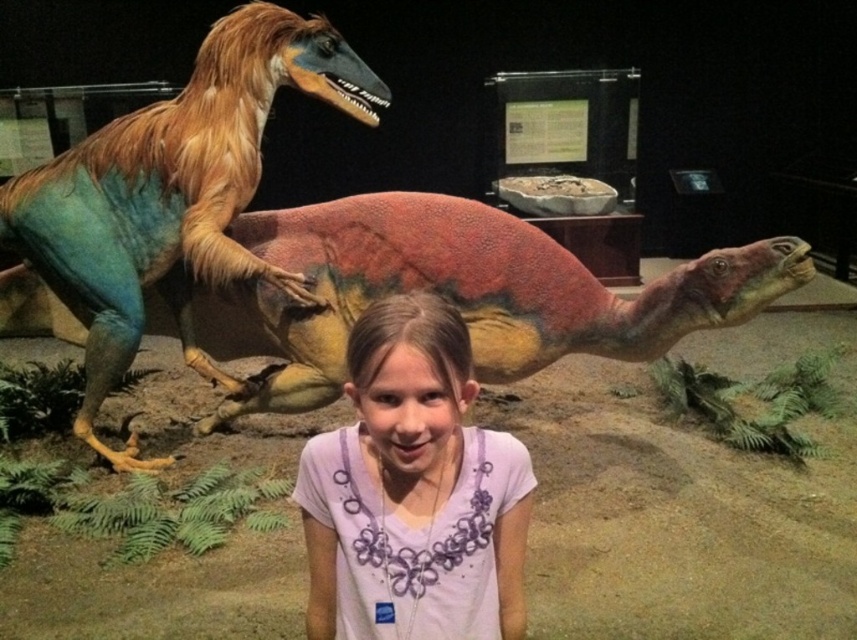
You are a museum visitor standing in front of the multicolored textured dinosaur at center and the purple cotton shirt at center. Which object is taller?

The multicolored textured dinosaur at center is taller than the purple cotton shirt at center.

You are a visitor standing in the museum and want to take a photo of the multicolored glossy dinosaur at left. If your camera has a maximum focus range of 3 meters, will you be able to capture it clearly?

The multicolored glossy dinosaur at left is 2.92 meters from viewer, which is within the camera maximum focus range of 3 meters, so yes, you can capture it clearly.